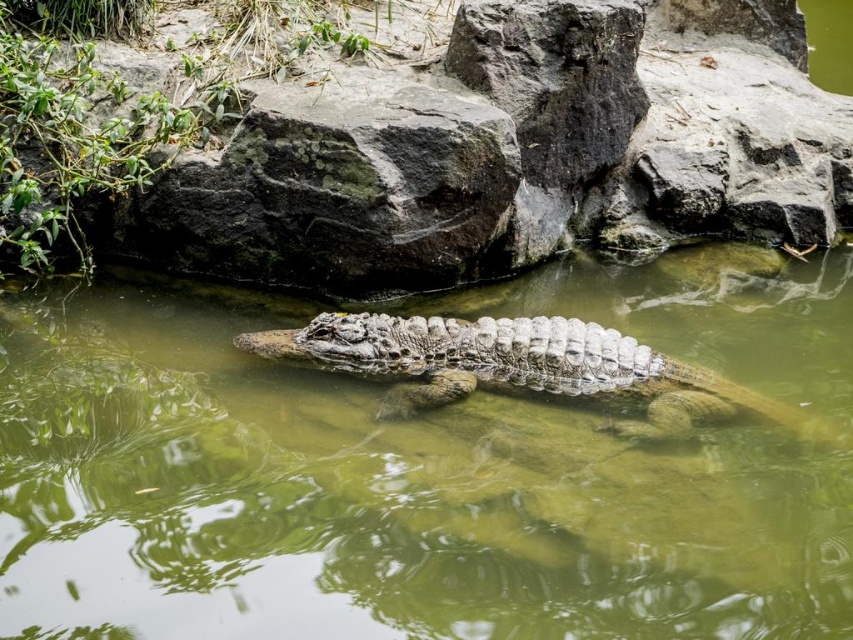
You are a wildlife photographer aiming to capture the scaly brown crocodile at center in the greenish murky water at center. Given the water size and crocodile size, will the crocodile be mostly submerged even if it stays still?

The greenish murky water at center has a larger size compared to the scaly brown crocodile at center, so yes, the crocodile will remain mostly submerged even when still.